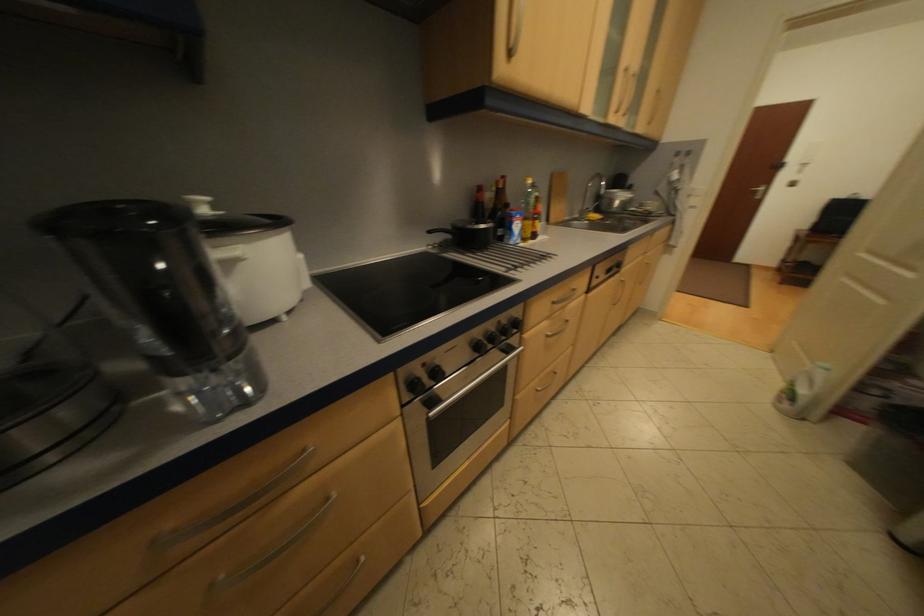
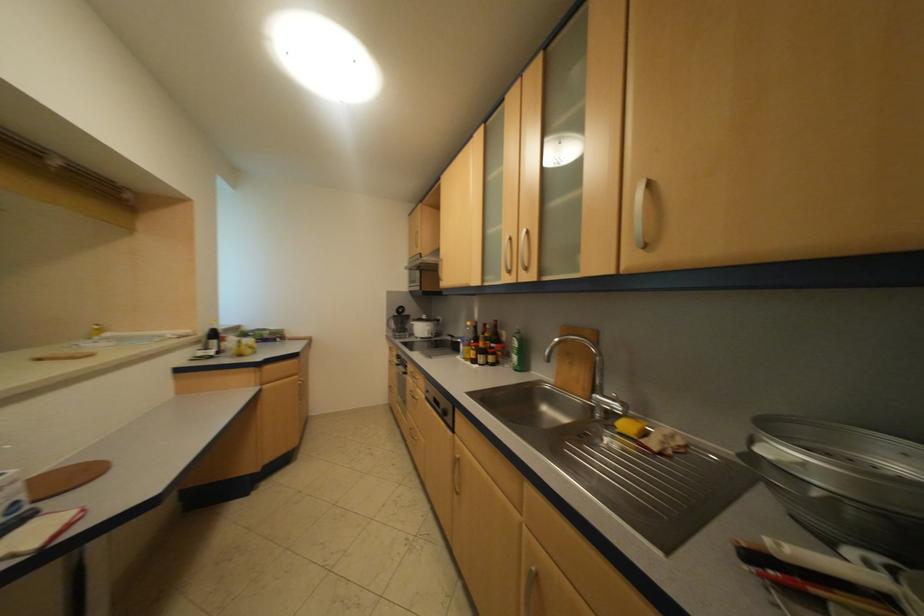
Find the pixel in the second image that matches (225,207) in the first image.

(438, 318)